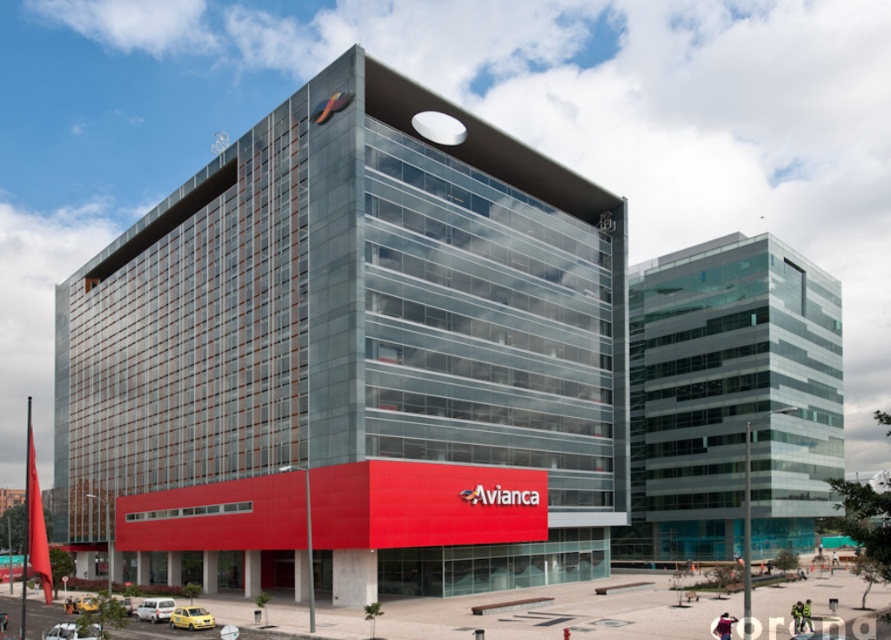
Measure the distance between glassy modern building at center and transparent glass building at center.

glassy modern building at center and transparent glass building at center are 31.71 meters apart from each other.

Based on the photo, is glassy modern building at center behind transparent glass building at center?

No.

Between point (606, 211) and point (669, 360), which one is positioned in front?

Point (606, 211) is in front.

Where is `glassy modern building at center`? glassy modern building at center is located at coordinates (353, 358).